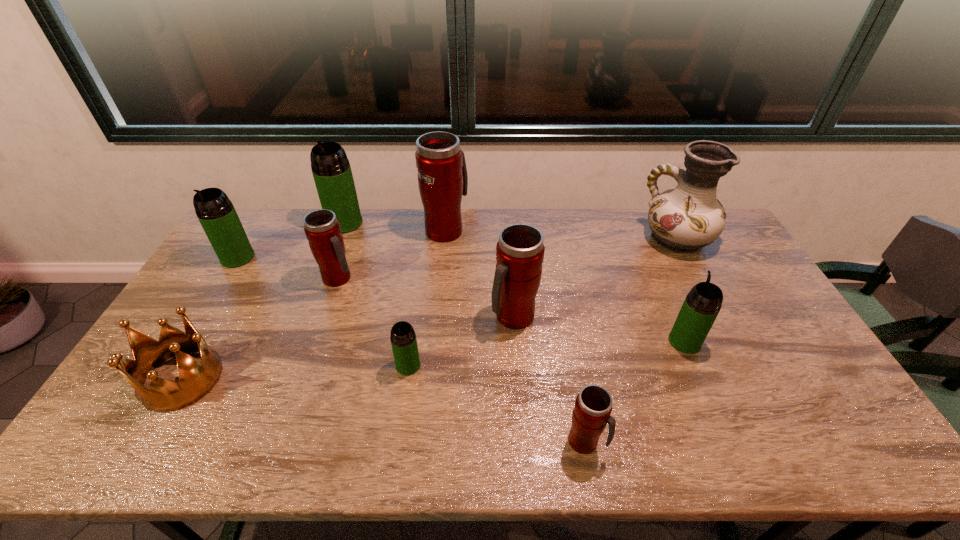
Identify the location of vacant area that lies between the third biggest green thermos bottle and the third smallest red thermos bottle. This screenshot has width=960, height=540. (599, 329).

This screenshot has height=540, width=960. What are the coordinates of `free spot between the farthest red thermos bottle and the smallest green thermos bottle` in the screenshot? It's located at 427,298.

Where is `empty space that is in between the third red thermos bottle from right to left and the rightmost green thermos bottle`? This screenshot has width=960, height=540. empty space that is in between the third red thermos bottle from right to left and the rightmost green thermos bottle is located at coordinates (565, 286).

Identify the location of free space that is in between the smallest green thermos bottle and the smallest red thermos bottle. Image resolution: width=960 pixels, height=540 pixels. (496, 403).

Where is `free space between the third nearest green thermos bottle and the third red thermos bottle from left to right`? The height and width of the screenshot is (540, 960). free space between the third nearest green thermos bottle and the third red thermos bottle from left to right is located at coordinates (375, 287).

You are a GUI agent. You are given a task and a screenshot of the screen. Output one action in this format:
    pyautogui.click(x=<x>, y=<y>)
    Task: Click on the vacant area that lies between the vase and the second smallest green thermos bottle
    
    Given the screenshot: What is the action you would take?
    pyautogui.click(x=681, y=291)

This screenshot has width=960, height=540. I want to click on free point between the third smallest green thermos bottle and the crown, so click(x=210, y=318).

Identify the location of blank region between the third farthest green thermos bottle and the smallest red thermos bottle. Image resolution: width=960 pixels, height=540 pixels. (635, 392).

This screenshot has height=540, width=960. Identify the location of vacant area that lies between the crown and the third farthest green thermos bottle. (433, 360).

Find the location of `object that can be found as the seventh closest to the second farthest green thermos bottle`. object that can be found as the seventh closest to the second farthest green thermos bottle is located at coordinates (593, 406).